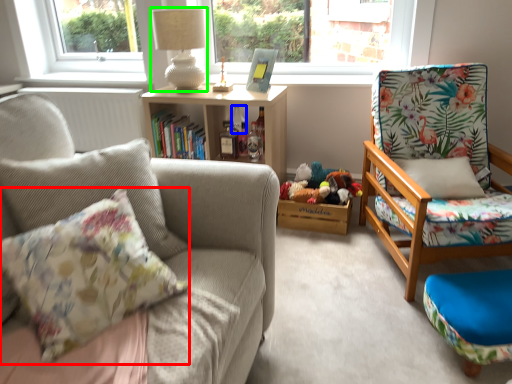
Question: Estimate the real-world distances between objects in this image. Which object is closer to pillow (highlighted by a red box), bottle (highlighted by a blue box) or lamp (highlighted by a green box)?

Choices:
 (A) bottle
 (B) lamp

Answer: (B)